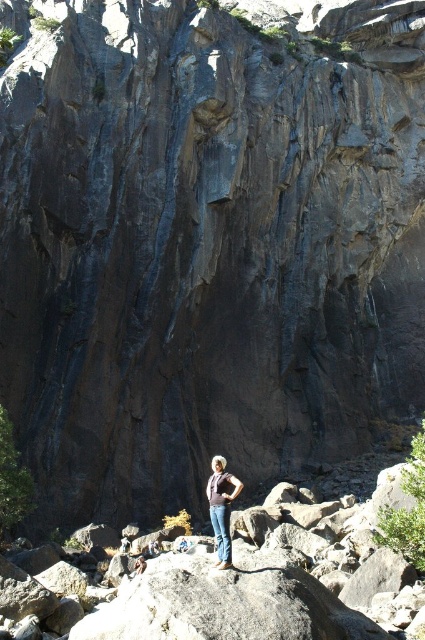
Who is positioned more to the right, denim pants at center or denim jeans at center?

denim pants at center

The width and height of the screenshot is (425, 640). In order to click on denim pants at center in this screenshot , I will do `click(221, 508)`.

Who is more forward, (217, 518) or (144, 568)?

Point (217, 518) is in front.

Find the location of a particular element. Image resolution: width=425 pixels, height=640 pixels. denim pants at center is located at coordinates (221, 508).